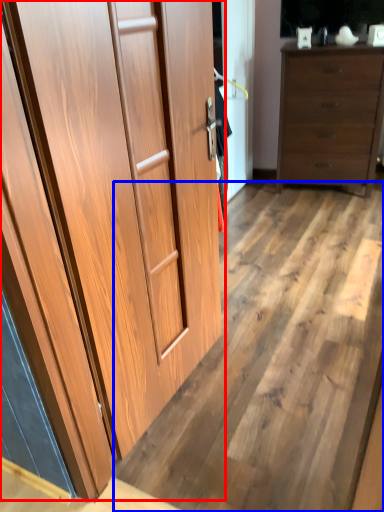
Question: Among these objects, which one is nearest to the camera, cupboard (highlighted by a red box) or plywood (highlighted by a blue box)?

Choices:
 (A) cupboard
 (B) plywood

Answer: (A)